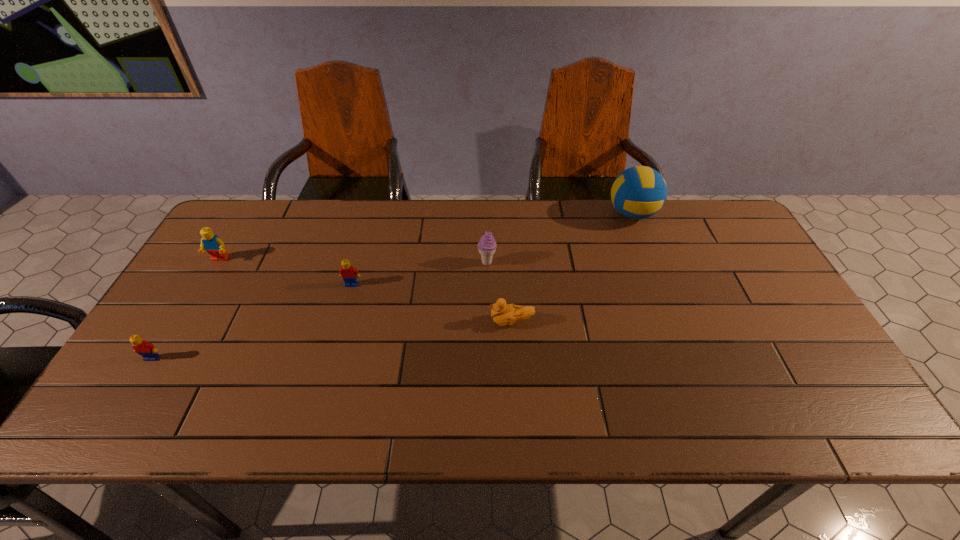
Where is `vacant region at the far right corner of the desktop`? This screenshot has width=960, height=540. vacant region at the far right corner of the desktop is located at coordinates (721, 239).

Identify the location of free spot between the rightmost object and the farthest Lego. The width and height of the screenshot is (960, 540). (426, 237).

The image size is (960, 540). Identify the location of vacant area that lies between the tallest Lego and the icecream. (353, 261).

At what (x,y) coordinates should I click in order to perform the action: click on empty location between the rightmost Lego and the nearest Lego. Please return your answer as a coordinate pair (x, y). This screenshot has height=540, width=960. Looking at the image, I should click on (252, 321).

You are a GUI agent. You are given a task and a screenshot of the screen. Output one action in this format:
    pyautogui.click(x=<x>, y=<y>)
    Task: Click on the free space between the second nearest object and the icecream
    The image size is (960, 540).
    Given the screenshot: What is the action you would take?
    pyautogui.click(x=499, y=292)

You are a GUI agent. You are given a task and a screenshot of the screen. Output one action in this format:
    pyautogui.click(x=<x>, y=<y>)
    Task: Click on the empty space between the nearest Lego and the third object from left to right
    
    Given the screenshot: What is the action you would take?
    pyautogui.click(x=252, y=321)

You are a GUI agent. You are given a task and a screenshot of the screen. Output one action in this format:
    pyautogui.click(x=<x>, y=<y>)
    Task: Click on the free space between the nearest object and the fourth farthest object
    This screenshot has height=540, width=960.
    Given the screenshot: What is the action you would take?
    pyautogui.click(x=252, y=321)

Locate an element on the screen. This screenshot has width=960, height=540. vacant area between the fourth farthest object and the icecream is located at coordinates (420, 273).

Where is `empty space that is in between the nearest Lego and the icecream`? This screenshot has height=540, width=960. empty space that is in between the nearest Lego and the icecream is located at coordinates (320, 310).

The image size is (960, 540). Identify the location of unoccupied area between the nearest object and the third nearest object. (252, 321).